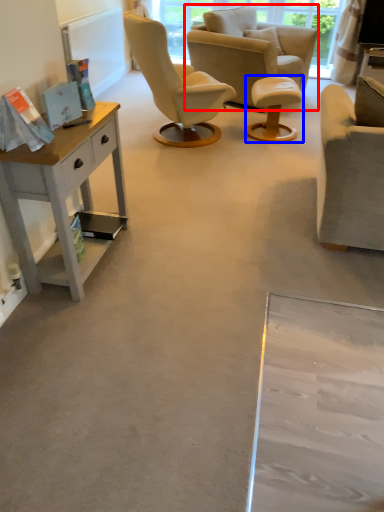
Question: Which of the following is the farthest to the observer, chair (highlighted by a red box) or stool (highlighted by a blue box)?

Choices:
 (A) chair
 (B) stool

Answer: (A)